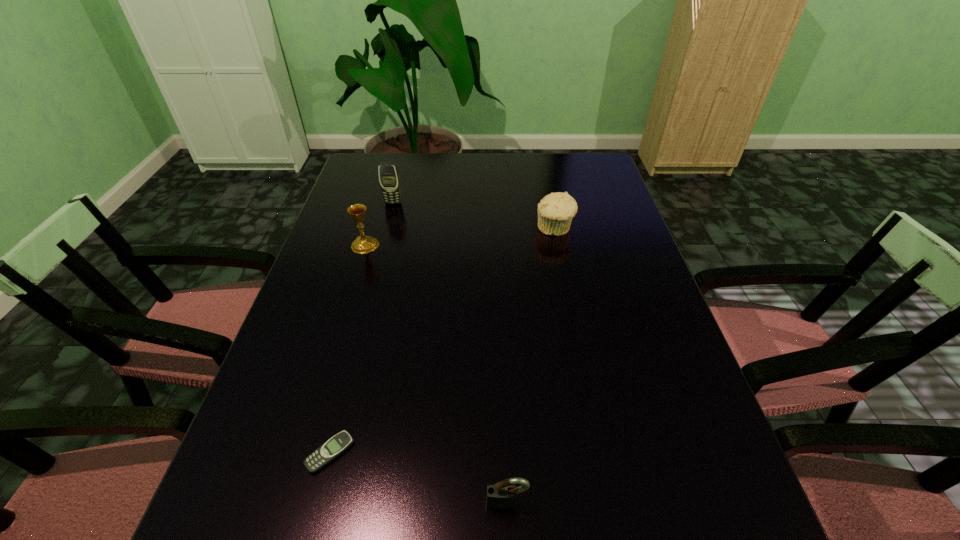
Where is `blank region between the beeper and the farthest object`? The height and width of the screenshot is (540, 960). blank region between the beeper and the farthest object is located at coordinates pyautogui.click(x=362, y=328).

Locate an element on the screen. The width and height of the screenshot is (960, 540). free space between the shortest object and the muffin is located at coordinates (443, 341).

At what (x,y) coordinates should I click in order to perform the action: click on free space between the chalice and the cellular telephone. Please return your answer as a coordinate pair (x, y). The height and width of the screenshot is (540, 960). Looking at the image, I should click on (379, 224).

Locate an element on the screen. The width and height of the screenshot is (960, 540). free area in between the nearest object and the cellular telephone is located at coordinates (450, 353).

The width and height of the screenshot is (960, 540). Identify the location of free spot between the second shortest object and the rightmost object. (531, 365).

This screenshot has height=540, width=960. In order to click on free space between the shortest object and the cellular telephone in this screenshot , I will do `click(362, 328)`.

Find the location of a particular element. The image size is (960, 540). empty space that is in between the beeper and the padlock is located at coordinates (419, 477).

This screenshot has height=540, width=960. I want to click on empty location between the chalice and the beeper, so click(348, 349).

Identify the location of vacant space that is in between the muffin and the padlock. This screenshot has height=540, width=960. (531, 365).

Where is `object that can be found as the closest to the farthest object`? This screenshot has width=960, height=540. object that can be found as the closest to the farthest object is located at coordinates (362, 244).